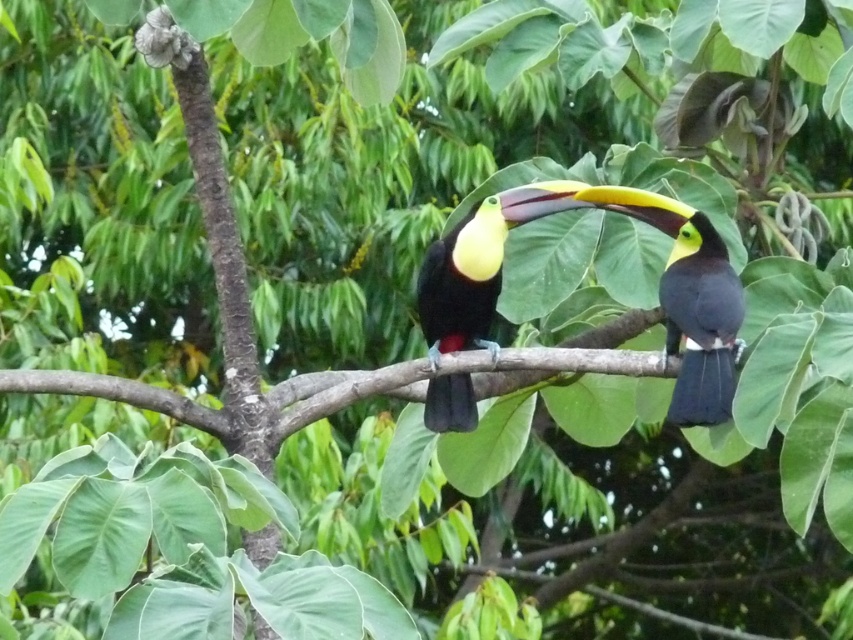
Question: Is shiny black toucan at center to the right of yellow glossy toucan at center from the viewer's perspective?

Choices:
 (A) no
 (B) yes

Answer: (B)

Question: Which object is closer to the camera taking this photo?

Choices:
 (A) shiny black toucan at center
 (B) yellow glossy toucan at center

Answer: (A)

Question: Is shiny black toucan at center positioned behind yellow glossy toucan at center?

Choices:
 (A) no
 (B) yes

Answer: (A)

Question: Can you confirm if shiny black toucan at center is positioned above yellow glossy toucan at center?

Choices:
 (A) yes
 (B) no

Answer: (A)

Question: Among these points, which one is nearest to the camera?

Choices:
 (A) (706, 216)
 (B) (471, 236)

Answer: (B)